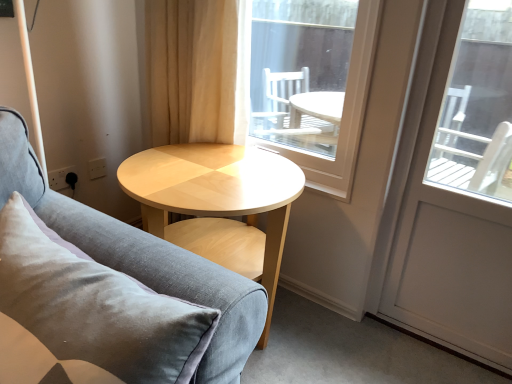
Question: Would you consider light wood/texture coffee table at center to be distant from velvet grey couch at center?

Choices:
 (A) no
 (B) yes

Answer: (A)

Question: From the image's perspective, is light wood/texture coffee table at center under velvet grey couch at center?

Choices:
 (A) yes
 (B) no

Answer: (B)

Question: Considering the relative sizes of light wood/texture coffee table at center and velvet grey couch at center in the image provided, is light wood/texture coffee table at center smaller than velvet grey couch at center?

Choices:
 (A) yes
 (B) no

Answer: (A)

Question: Is light wood/texture coffee table at center at the left side of velvet grey couch at center?

Choices:
 (A) yes
 (B) no

Answer: (B)

Question: From a real-world perspective, is light wood/texture coffee table at center located higher than velvet grey couch at center?

Choices:
 (A) yes
 (B) no

Answer: (B)

Question: Is velvet grey couch at center inside light wood/texture coffee table at center?

Choices:
 (A) no
 (B) yes

Answer: (A)

Question: From the image's perspective, is transparent glass window at center over beige fabric curtain at upper center?

Choices:
 (A) no
 (B) yes

Answer: (A)

Question: From a real-world perspective, is transparent glass window at center positioned over beige fabric curtain at upper center based on gravity?

Choices:
 (A) yes
 (B) no

Answer: (B)

Question: Does transparent glass window at center have a larger size compared to beige fabric curtain at upper center?

Choices:
 (A) no
 (B) yes

Answer: (A)

Question: From the image's perspective, would you say transparent glass window at center is shown under beige fabric curtain at upper center?

Choices:
 (A) yes
 (B) no

Answer: (A)

Question: Can you confirm if transparent glass window at center is taller than beige fabric curtain at upper center?

Choices:
 (A) yes
 (B) no

Answer: (A)

Question: Does transparent glass window at center appear on the left side of beige fabric curtain at upper center?

Choices:
 (A) no
 (B) yes

Answer: (A)

Question: From a real-world perspective, is beige fabric curtain at upper center located beneath transparent glass window at center?

Choices:
 (A) no
 (B) yes

Answer: (A)